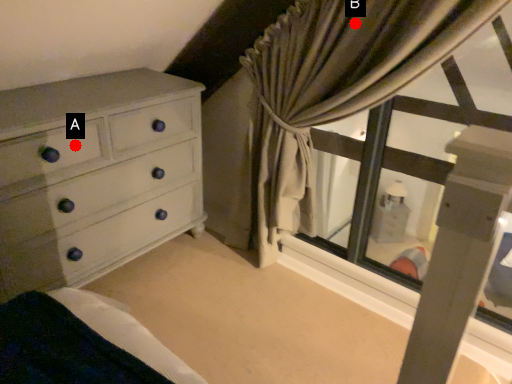
Question: Two points are circled on the image, labeled by A and B beside each circle. Which point is closer to the camera taking this photo?

Choices:
 (A) A is closer
 (B) B is closer

Answer: (B)